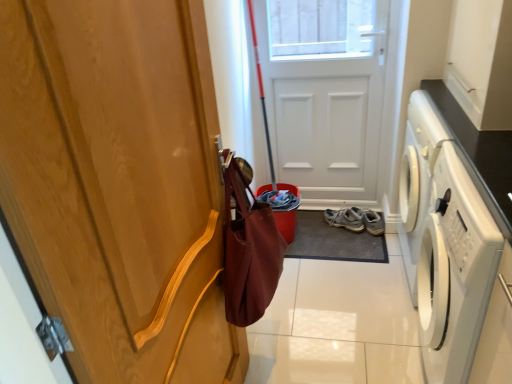
Locate an element on the screen. The height and width of the screenshot is (384, 512). wooden door handle at left, which is the 1th door in left-to-right order is located at coordinates (119, 184).

Find the location of `dark gray rubber doormat at center`. dark gray rubber doormat at center is located at coordinates (333, 241).

Identify the location of white glossy tile at lower center. (354, 302).

Find the location of a particular element. The width and height of the screenshot is (512, 384). white glossy washing machine at right is located at coordinates (447, 242).

This screenshot has width=512, height=384. What do you see at coordinates (447, 242) in the screenshot?
I see `white glossy washing machine at right` at bounding box center [447, 242].

Locate an element on the screen. wooden door handle at left, which is the 1th door in left-to-right order is located at coordinates (119, 184).

Is wooden door handle at left, marked as the 2th door in a back-to-front arrangement, inside white glossy washing machine at right?

That's incorrect, wooden door handle at left, marked as the 2th door in a back-to-front arrangement, is not inside white glossy washing machine at right.

Is the surface of white glossy washing machine at right in direct contact with wooden door handle at left, which is the 1th door in left-to-right order?

white glossy washing machine at right and wooden door handle at left, which is the 1th door in left-to-right order, are not in contact.

From a real-world perspective, which is physically below, white glossy washing machine at right or wooden door handle at left, marked as the 2th door in a back-to-front arrangement?

In real-world perspective, white glossy washing machine at right is lower.

Which object is positioned more to the right, matte brown tote at center or white glossy tile at lower center?

white glossy tile at lower center is more to the right.

Is point (245, 238) positioned in front of point (331, 321)?

Yes, point (245, 238) is closer to viewer.

From a real-world perspective, which object rests below the other?

white glossy tile at lower center is physically lower.

Where is `tile lying below the matte brown tote at center (from the image's perspective)`? This screenshot has width=512, height=384. tile lying below the matte brown tote at center (from the image's perspective) is located at coordinates (354, 302).

Considering the relative positions of dark gray rubber doormat at center and matte brown tote at center in the image provided, is dark gray rubber doormat at center behind matte brown tote at center?

That is True.

Can you tell me how much dark gray rubber doormat at center and matte brown tote at center differ in facing direction?

91.8 degrees separate the facing orientations of dark gray rubber doormat at center and matte brown tote at center.

Considering the positions of objects dark gray rubber doormat at center and matte brown tote at center in the image provided, who is more to the right, dark gray rubber doormat at center or matte brown tote at center?

Positioned to the right is dark gray rubber doormat at center.

From the picture: Is matte brown tote at center surrounding wooden door handle at left, which is the 1th door from front to back?

No, wooden door handle at left, which is the 1th door from front to back, is not inside matte brown tote at center.

From the image's perspective, is matte brown tote at center beneath wooden door handle at left, marked as the 2th door in a back-to-front arrangement?

Indeed, from the image's perspective, matte brown tote at center is shown beneath wooden door handle at left, marked as the 2th door in a back-to-front arrangement.

Considering the relative positions of matte brown tote at center and wooden door handle at left, which is the 1th door in left-to-right order, in the image provided, is matte brown tote at center in front of wooden door handle at left, which is the 1th door in left-to-right order,?

No, matte brown tote at center is further to the viewer.

In the image, is dark gray rubber doormat at center on the left side or the right side of wooden door handle at left, which is the 1th door in left-to-right order?

dark gray rubber doormat at center is positioned on wooden door handle at left, which is the 1th door in left-to-right order,'s right side.

Consider the image. Is dark gray rubber doormat at center further to camera compared to wooden door handle at left, which is the 1th door in left-to-right order?

Yes, dark gray rubber doormat at center is further from the camera.

Consider the image. Is dark gray rubber doormat at center not near wooden door handle at left, marked as the 2th door in a back-to-front arrangement?

Answer: Indeed, dark gray rubber doormat at center is not near wooden door handle at left, marked as the 2th door in a back-to-front arrangement.

Measure the distance between matte brown tote at center and white matte door at center, placed as the second door when sorted from left to right.

matte brown tote at center is 4.02 feet away from white matte door at center, placed as the second door when sorted from left to right.

Between matte brown tote at center and white matte door at center, the 2th door when ordered from front to back, which one is positioned in front?

matte brown tote at center is closer to the camera.

Which is more to the left, matte brown tote at center or white matte door at center, marked as the 1th door in a back-to-front arrangement?

Positioned to the left is matte brown tote at center.

In terms of width, does matte brown tote at center look wider or thinner when compared to white matte door at center, the 2th door when ordered from front to back?

matte brown tote at center is wider than white matte door at center, the 2th door when ordered from front to back.

In the scene shown: Which point is more distant from viewer, (237,348) or (225,259)?

The point (237,348) is farther.

You are a GUI agent. You are given a task and a screenshot of the screen. Output one action in this format:
    pyautogui.click(x=<x>, y=<y>)
    Task: Click on the shopping bag behind the wooden door handle at left, which is the 1th door in left-to-right order
    This screenshot has width=512, height=384.
    Given the screenshot: What is the action you would take?
    pyautogui.click(x=248, y=247)

Could you measure the distance between wooden door handle at left, which is the 1th door in left-to-right order, and matte brown tote at center?

11.36 inches.

Is wooden door handle at left, which is the 1th door from front to back, wider than matte brown tote at center?

No, wooden door handle at left, which is the 1th door from front to back, is not wider than matte brown tote at center.

Starting from the white glossy washing machine at right, which door is the 2nd one to the left? Please provide its 2D coordinates.

[(119, 184)]

I want to click on shopping bag positioned vertically above the white glossy tile at lower center (from a real-world perspective), so click(x=248, y=247).

When comparing their distances from white glossy washing machine at right, does wooden door handle at left, which is the second door in right-to-left order, or white glossy tile at lower center seem closer?

white glossy tile at lower center is positioned closer to the anchor white glossy washing machine at right.

From the image, which object appears to be farther from white glossy washing machine at right, white glossy tile at lower center or light brown suede sneakers at lower center?

light brown suede sneakers at lower center lies further to white glossy washing machine at right than the other object.

Looking at this image, considering their positions, is dark gray rubber doormat at center positioned closer to white matte door at center, marked as the 1th door in a back-to-front arrangement, than white glossy tile at lower center?

Based on the image, dark gray rubber doormat at center appears to be nearer to white matte door at center, marked as the 1th door in a back-to-front arrangement.

When comparing their distances from light brown suede sneakers at lower center, does wooden door handle at left, marked as the 2th door in a back-to-front arrangement, or white glossy tile at lower center seem closer?

white glossy tile at lower center lies closer to light brown suede sneakers at lower center than the other object.

Based on the photo, which object lies nearer to the anchor point dark gray rubber doormat at center, white matte door at center, the 2th door when ordered from front to back, or light brown suede sneakers at lower center?

Among the two, light brown suede sneakers at lower center is located nearer to dark gray rubber doormat at center.

From the image, which object appears to be nearer to white glossy washing machine at right, dark gray rubber doormat at center or matte brown tote at center?

matte brown tote at center is positioned closer to the anchor white glossy washing machine at right.

Consider the image. From the image, which object appears to be farther from light brown suede sneakers at lower center, wooden door handle at left, which is the 1th door in left-to-right order, or dark gray rubber doormat at center?

The object further to light brown suede sneakers at lower center is wooden door handle at left, which is the 1th door in left-to-right order.

Which object lies nearer to the anchor point wooden door handle at left, marked as the 2th door in a back-to-front arrangement, light brown suede sneakers at lower center or white matte door at center, which ranks as the 1th door in right-to-left order?

white matte door at center, which ranks as the 1th door in right-to-left order.

Where is `tile positioned between white glossy washing machine at right and white matte door at center, which ranks as the 1th door in right-to-left order, from near to far`? tile positioned between white glossy washing machine at right and white matte door at center, which ranks as the 1th door in right-to-left order, from near to far is located at coordinates (354, 302).

Identify the location of shopping bag located between wooden door handle at left, which is the 1th door from front to back, and white glossy washing machine at right in the left-right direction. The height and width of the screenshot is (384, 512). (248, 247).

Identify the location of tile between wooden door handle at left, which is the 1th door in left-to-right order, and light brown suede sneakers at lower center from front to back. (354, 302).

Locate an element on the screen. This screenshot has height=384, width=512. shopping bag between white glossy washing machine at right and white matte door at center, which ranks as the 1th door in right-to-left order, in the front-back direction is located at coordinates (248, 247).